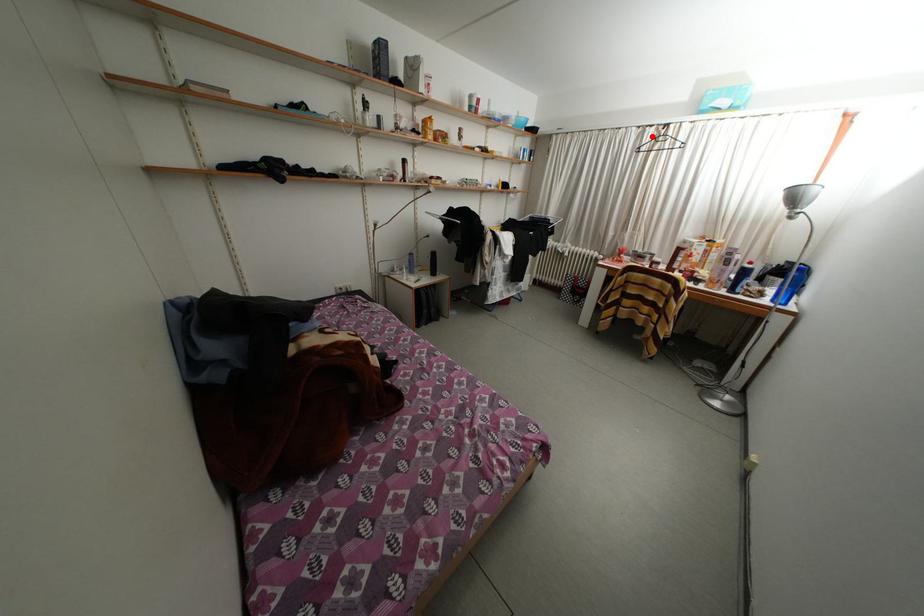
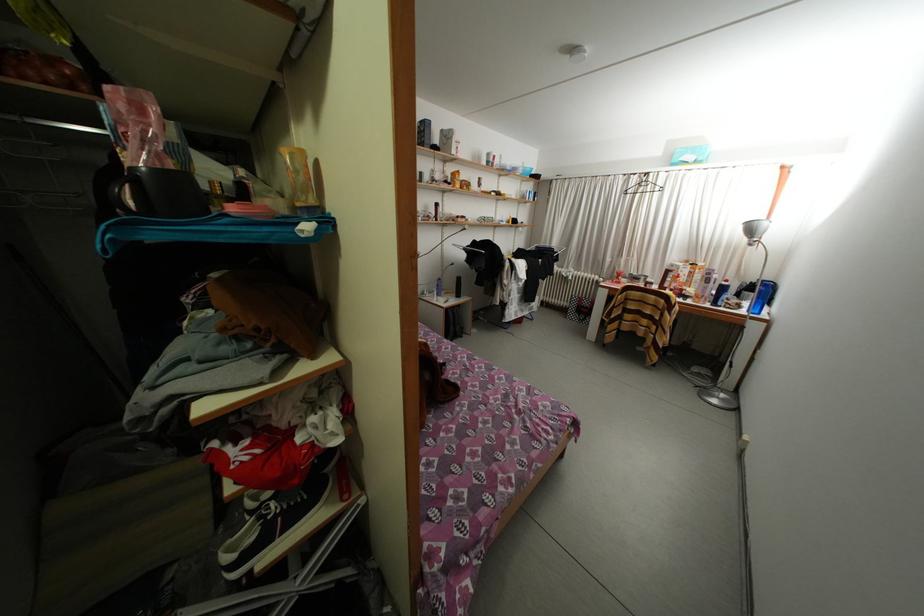
Find the pixel in the second image that matches the highlighted location in the first image.

(638, 184)